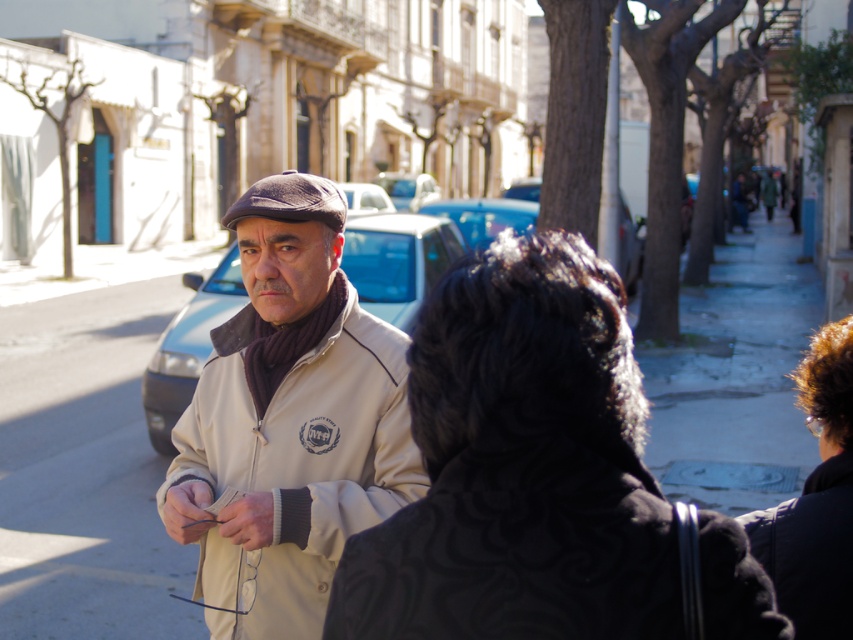
Who is more distant from viewer, (392, 579) or (206, 506)?

The point (206, 506) is more distant.

Does black textured coat at center have a lesser height compared to beige fabric jacket at center?

Yes.

The image size is (853, 640). In order to click on black textured coat at center in this screenshot , I will do `click(521, 467)`.

Who is taller, black textured coat at center or matte blue car at center?

matte blue car at center is taller.

Can you confirm if black textured coat at center is bigger than matte blue car at center?

Actually, black textured coat at center might be smaller than matte blue car at center.

Who is more forward, (495, 556) or (389, 269)?

Point (495, 556) is more forward.

Where is `black textured coat at center`? This screenshot has width=853, height=640. black textured coat at center is located at coordinates (521, 467).

Does point (775, 621) come farther from viewer compared to point (426, 244)?

No, (775, 621) is closer to viewer.

Which is behind, point (746, 550) or point (381, 292)?

Positioned behind is point (381, 292).

Does point (549, 465) lie in front of point (392, 232)?

Yes, point (549, 465) is closer to viewer.

Where is `black textured jacket at center`? black textured jacket at center is located at coordinates (518, 548).